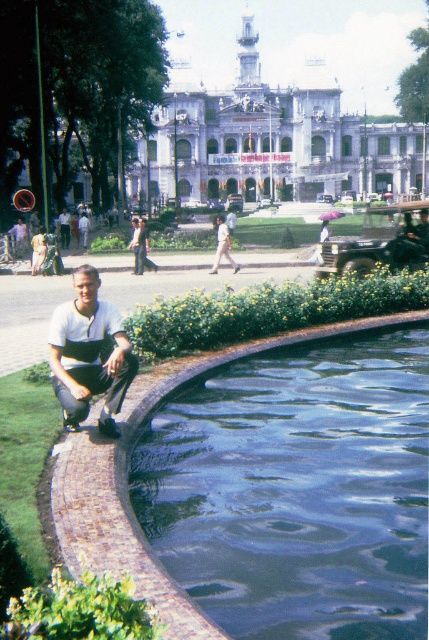
Does white stone building at center have a larger size compared to white cotton shirt at lower left?

Yes, white stone building at center is bigger than white cotton shirt at lower left.

Locate an element on the screen. The width and height of the screenshot is (429, 640). white stone building at center is located at coordinates (271, 144).

Between point (189, 132) and point (96, 339), which one is positioned behind?

The point (189, 132) is behind.

Find the location of `white stone building at center`. white stone building at center is located at coordinates (271, 144).

Which of these two, blue polished stone pool at lower center or metallic green jeep at center-right, stands shorter?

metallic green jeep at center-right

Which is more to the right, blue polished stone pool at lower center or metallic green jeep at center-right?

Positioned to the right is metallic green jeep at center-right.

Between point (151, 508) and point (377, 227), which one is positioned behind?

Positioned behind is point (377, 227).

Where is `blue polished stone pool at lower center`? This screenshot has width=429, height=640. blue polished stone pool at lower center is located at coordinates (298, 490).

Does white cotton shirt at lower left have a lesser width compared to metallic green jeep at center-right?

Indeed, white cotton shirt at lower left has a lesser width compared to metallic green jeep at center-right.

Which is behind, point (109, 376) or point (349, 252)?

Point (349, 252)

Locate an element on the screen. white cotton shirt at lower left is located at coordinates (88, 355).